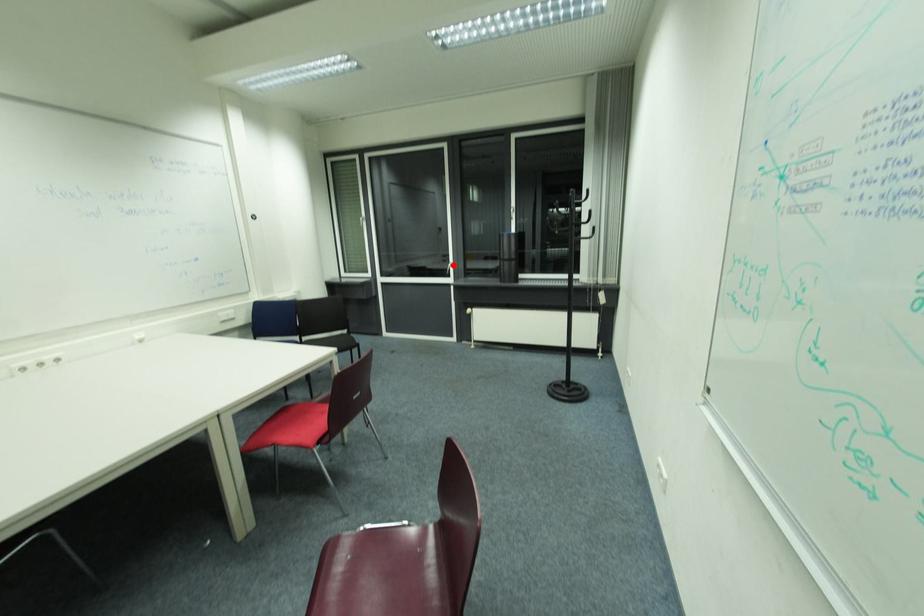
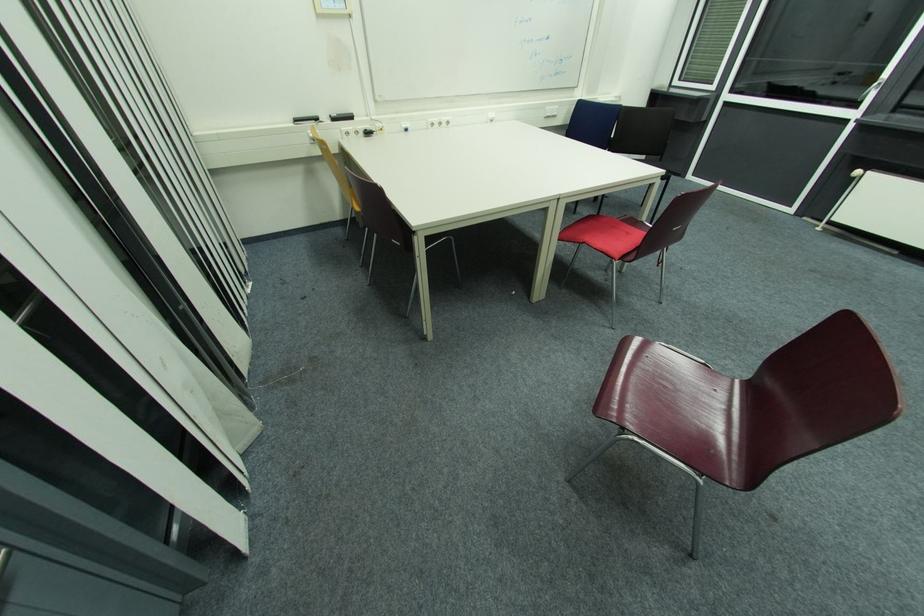
Locate, in the second image, the point that corresponds to the highlighted location in the first image.

(880, 84)